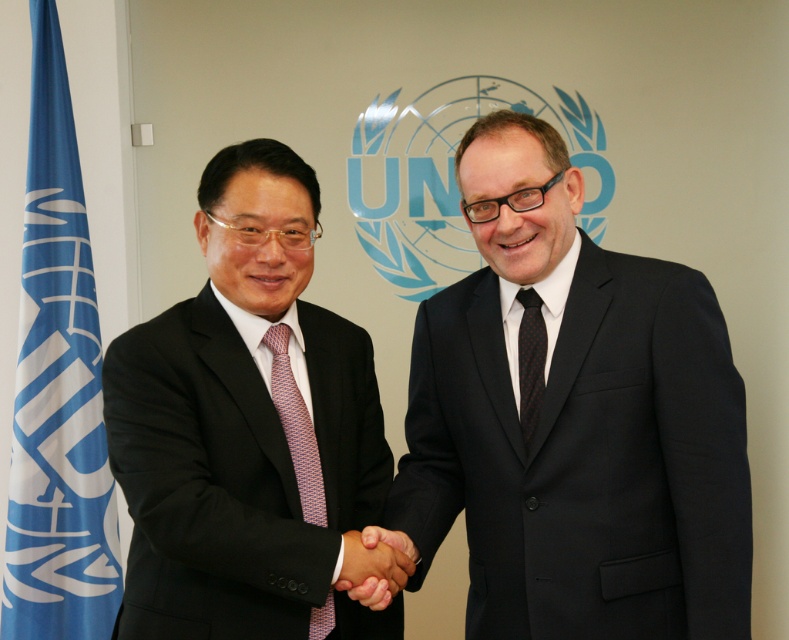
You are a photographer at the UN event. You need to capture a photo where both the blue fabric flag at left and the black dotted tie at center are clearly visible. Given that the camera can only focus on objects within a 1.2 meter width, will both objects fit within this focus range?

The blue fabric flag at left is larger in size than the black dotted tie at center. Since the camera requires a focus range of 1.2 meters, and the flag is bigger, it might occupy more space. However, without exact distance measurements, it is uncertain if both will fit within the 1.2 meter width. Additional information about their distances from the camera is needed to determine this.

Looking at the two individuals shaking hands in front of the UN emblem, which tie is positioned to the left side of the other? Mention both the pink dotted tie at center and black dotted tie at center in your answer.

The pink dotted tie at center is positioned to the left of the black dotted tie at center.